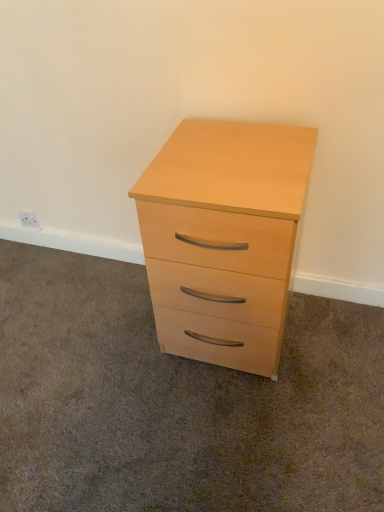
You are a GUI agent. You are given a task and a screenshot of the screen. Output one action in this format:
    pyautogui.click(x=<x>, y=<y>)
    Task: Click on the free space in front of light wood chest of drawers at center
    This screenshot has height=512, width=384.
    Given the screenshot: What is the action you would take?
    pyautogui.click(x=236, y=431)